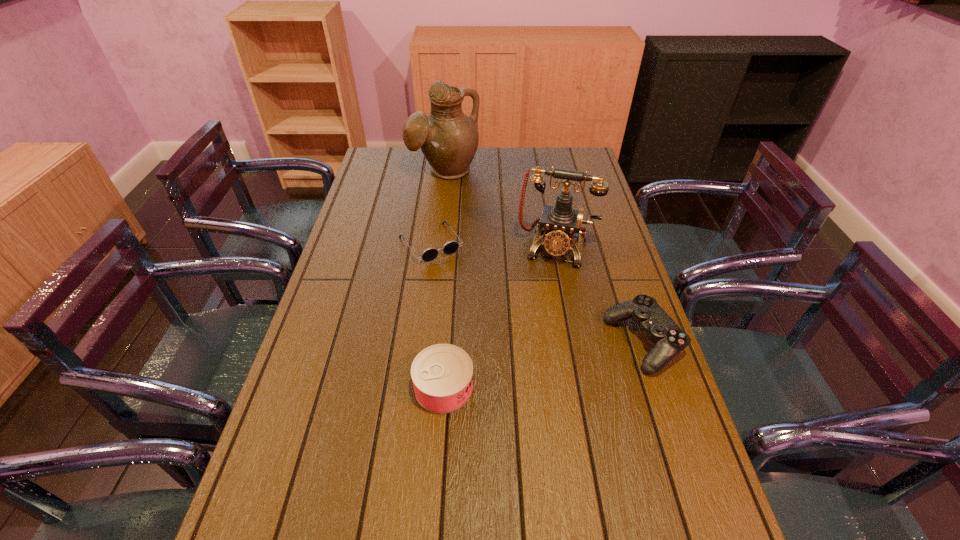
Find the location of a particular element. The width and height of the screenshot is (960, 540). vacant position located 0.140m on the front of the fourth shortest object, featuring the rotary dial is located at coordinates (541, 301).

The width and height of the screenshot is (960, 540). I want to click on vacant point located 0.060m at the spout of the pitcher, so click(x=462, y=197).

You are a GUI agent. You are given a task and a screenshot of the screen. Output one action in this format:
    pyautogui.click(x=<x>, y=<y>)
    Task: Click on the free location located 0.390m at the spout of the pitcher
    This screenshot has height=540, width=960.
    Given the screenshot: What is the action you would take?
    pyautogui.click(x=496, y=249)

In order to click on vacant region located at the spout of the pitcher in this screenshot , I will do `click(480, 225)`.

In order to click on vacant space located 0.350m on the front-facing side of the shortest object in this screenshot , I will do `click(500, 342)`.

Locate an element on the screen. vacant space located on the front-facing side of the shortest object is located at coordinates 463,289.

At what (x,y) coordinates should I click in order to perform the action: click on vacant space situated on the front-facing side of the shortest object. Please return your answer as a coordinate pair (x, y). Looking at the image, I should click on (473, 305).

Find the location of a particular element. object at the far edge is located at coordinates (448, 138).

Locate an element on the screen. control at the right edge is located at coordinates (670, 340).

The image size is (960, 540). I want to click on telephone that is at the right edge, so click(560, 221).